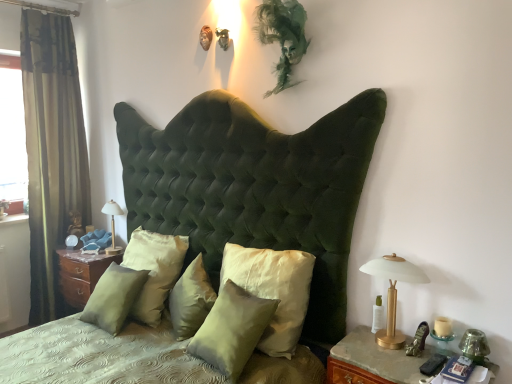
This screenshot has height=384, width=512. What do you see at coordinates (191, 299) in the screenshot? I see `satin green pillow at center, the 3th pillow positioned from the left` at bounding box center [191, 299].

What is the approximate width of matte white lampshade at center, the 1th bedside lamp from the back?

matte white lampshade at center, the 1th bedside lamp from the back, is 5.35 inches wide.

This screenshot has width=512, height=384. What do you see at coordinates (273, 290) in the screenshot?
I see `satin/velvet pillow at center, the 5th pillow in the left-to-right sequence` at bounding box center [273, 290].

How much space does gold metallic bedside lamp at right, which is counted as the second bedside lamp, starting from the left, occupy horizontally?

It is 5.69 inches.

Image resolution: width=512 pixels, height=384 pixels. I want to click on green velvet curtain at left, so click(52, 152).

Image resolution: width=512 pixels, height=384 pixels. Identify the location of satin green pillow at center, the 3th pillow positioned from the left. (191, 299).

From the image's perspective, which one is positioned lower, satin green pillow at center, the 5th pillow positioned from the right, or satin wood nightstand at lower left, marked as the second nightstand in a front-to-back arrangement?

From the image's view, satin wood nightstand at lower left, marked as the second nightstand in a front-to-back arrangement, is below.

In terms of width, does satin green pillow at center, the 5th pillow positioned from the right, look wider or thinner when compared to satin wood nightstand at lower left, placed as the first nightstand when sorted from left to right?

satin green pillow at center, the 5th pillow positioned from the right, is thinner than satin wood nightstand at lower left, placed as the first nightstand when sorted from left to right.

How many degrees apart are the facing directions of satin green pillow at center, the 1th pillow positioned from the left, and satin wood nightstand at lower left, placed as the first nightstand when sorted from left to right?

1.61 degrees.

Considering the positions of objects satin green pillow at center, the 5th pillow positioned from the right, and satin wood nightstand at lower left, marked as the first nightstand in a back-to-front arrangement, in the image provided, who is in front, satin green pillow at center, the 5th pillow positioned from the right, or satin wood nightstand at lower left, marked as the first nightstand in a back-to-front arrangement,?

Positioned in front is satin green pillow at center, the 5th pillow positioned from the right.

Between gold metallic bedside lamp at right, marked as the second bedside lamp in a back-to-front arrangement, and transparent glass window at left, which one appears on the left side from the viewer's perspective?

Positioned to the left is transparent glass window at left.

Is gold metallic bedside lamp at right, acting as the 1th bedside lamp starting from the front, taller than transparent glass window at left?

No.

Can transparent glass window at left be found inside gold metallic bedside lamp at right, which is counted as the second bedside lamp, starting from the left?

Definitely not — transparent glass window at left is not inside gold metallic bedside lamp at right, which is counted as the second bedside lamp, starting from the left.

Which bedside lamp is the 2nd one when counting from the front of the transparent glass window at left? Please provide its 2D coordinates.

[(393, 293)]

Is green velvet curtain at left turned away from velvet green headboard at center?

No, green velvet curtain at left's orientation is not away from velvet green headboard at center.

Is green velvet curtain at left to the left or to the right of velvet green headboard at center in the image?

From the image, it's evident that green velvet curtain at left is to the left of velvet green headboard at center.

In terms of width, does green velvet curtain at left look wider or thinner when compared to velvet green headboard at center?

Clearly, green velvet curtain at left has less width compared to velvet green headboard at center.

Is green velvet curtain at left touching velvet green headboard at center?

There is a gap between green velvet curtain at left and velvet green headboard at center.

From the image's perspective, which one is positioned higher, wooden nightstand at lower right, the 2th nightstand when ordered from back to front, or satin wood nightstand at lower left, marked as the second nightstand in a front-to-back arrangement?

satin wood nightstand at lower left, marked as the second nightstand in a front-to-back arrangement, from the image's perspective.

Consider the image. Between wooden nightstand at lower right, positioned as the first nightstand in front-to-back order, and satin wood nightstand at lower left, arranged as the 2th nightstand when viewed from the right, which one appears on the left side from the viewer's perspective?

Positioned to the left is satin wood nightstand at lower left, arranged as the 2th nightstand when viewed from the right.

Which object is thinner, wooden nightstand at lower right, positioned as the first nightstand in front-to-back order, or satin wood nightstand at lower left, placed as the first nightstand when sorted from left to right?

satin wood nightstand at lower left, placed as the first nightstand when sorted from left to right, is thinner.

From a real-world perspective, between wooden nightstand at lower right, positioned as the first nightstand in front-to-back order, and satin wood nightstand at lower left, placed as the first nightstand when sorted from left to right, who is vertically higher?

From a 3D spatial view, wooden nightstand at lower right, positioned as the first nightstand in front-to-back order, is above.

From the image's perspective, is matte white lampshade at center, marked as the 2th bedside lamp in a front-to-back arrangement, on satin/velvet pillow at center, the fourth pillow from the right?

Yes, from the image's perspective, matte white lampshade at center, marked as the 2th bedside lamp in a front-to-back arrangement, is on top of satin/velvet pillow at center, the fourth pillow from the right.

From a real-world perspective, which object rests below the other?

satin/velvet pillow at center, the fourth pillow from the right, from a real-world perspective.

Is matte white lampshade at center, the second bedside lamp in the right-to-left sequence, next to satin/velvet pillow at center, which ranks as the 2th pillow in left-to-right order?

No, matte white lampshade at center, the second bedside lamp in the right-to-left sequence, is not beside satin/velvet pillow at center, which ranks as the 2th pillow in left-to-right order.

Considering the points (144, 239) and (404, 355), which point is behind, point (144, 239) or point (404, 355)?

The point (144, 239) is more distant.

Is there a large distance between satin/velvet pillow at center, which ranks as the 2th pillow in left-to-right order, and wooden nightstand at lower right, the 2th nightstand when ordered from back to front?

Indeed, satin/velvet pillow at center, which ranks as the 2th pillow in left-to-right order, is not near wooden nightstand at lower right, the 2th nightstand when ordered from back to front.

Considering the relative sizes of satin/velvet pillow at center, which ranks as the 2th pillow in left-to-right order, and wooden nightstand at lower right, the 2th nightstand when ordered from back to front, in the image provided, is satin/velvet pillow at center, which ranks as the 2th pillow in left-to-right order, bigger than wooden nightstand at lower right, the 2th nightstand when ordered from back to front,?

No.

Who is shorter, satin/velvet pillow at center, which ranks as the 2th pillow in left-to-right order, or wooden nightstand at lower right, which is the 1th nightstand in right-to-left order?

Standing shorter between the two is wooden nightstand at lower right, which is the 1th nightstand in right-to-left order.

Is velvet green headboard at center taller or shorter than satin wood nightstand at lower left, marked as the second nightstand in a front-to-back arrangement?

Considering their sizes, velvet green headboard at center has more height than satin wood nightstand at lower left, marked as the second nightstand in a front-to-back arrangement.

This screenshot has width=512, height=384. I want to click on bed on the right of the satin wood nightstand at lower left, arranged as the 2th nightstand when viewed from the right, so pyautogui.click(x=255, y=186).

Between velvet green headboard at center and satin wood nightstand at lower left, marked as the first nightstand in a back-to-front arrangement, which one is positioned behind?

satin wood nightstand at lower left, marked as the first nightstand in a back-to-front arrangement, is behind.

Image resolution: width=512 pixels, height=384 pixels. There is a satin green pillow at center, the 5th pillow positioned from the right. Find the location of `the 1st nightstand below it (from the image's perspective)`. the 1st nightstand below it (from the image's perspective) is located at coordinates (81, 274).

Which bedside lamp is the 2nd one when counting from the right side of the transparent glass window at left? Please provide its 2D coordinates.

[(393, 293)]

Which object lies further to the anchor point gold metallic bedside lamp at right, which ranks as the 1th bedside lamp in right-to-left order, wooden nightstand at lower right, the 2th nightstand when ordered from back to front, or green velvet curtain at left?

green velvet curtain at left is further to gold metallic bedside lamp at right, which ranks as the 1th bedside lamp in right-to-left order.

Based on their spatial positions, is transparent glass window at left or gold metallic bedside lamp at right, which is counted as the second bedside lamp, starting from the left, closer to velvet green headboard at center?

Based on the image, gold metallic bedside lamp at right, which is counted as the second bedside lamp, starting from the left, appears to be nearer to velvet green headboard at center.

Based on the photo, from the image, which object appears to be nearer to wooden nightstand at lower right, positioned as the first nightstand in front-to-back order, satin/velvet pillow at center, which ranks as the 2th pillow in left-to-right order, or velvet green headboard at center?

velvet green headboard at center is closer to wooden nightstand at lower right, positioned as the first nightstand in front-to-back order.

Which object lies nearer to the anchor point satin green pillow at center, positioned as the 2th pillow in right-to-left order, velvet green headboard at center or satin green pillow at center, the 5th pillow positioned from the right?

velvet green headboard at center.

Estimate the real-world distances between objects in this image. Which object is closer to gold metallic bedside lamp at right, which is counted as the second bedside lamp, starting from the left, transparent glass window at left or matte white lampshade at center, the 1th bedside lamp from the back?

Among the two, matte white lampshade at center, the 1th bedside lamp from the back, is located nearer to gold metallic bedside lamp at right, which is counted as the second bedside lamp, starting from the left.

Considering their positions, is satin green pillow at center, the 3th pillow from the right, positioned further to green velvet curtain at left than velvet green headboard at center?

Among the two, satin green pillow at center, the 3th pillow from the right, is located further to green velvet curtain at left.

Looking at the image, which one is located further to satin wood nightstand at lower left, marked as the first nightstand in a back-to-front arrangement, satin/velvet pillow at center, the 5th pillow in the left-to-right sequence, or satin green pillow at center, the 1th pillow positioned from the left?

satin/velvet pillow at center, the 5th pillow in the left-to-right sequence.

Estimate the real-world distances between objects in this image. Which object is closer to wooden nightstand at lower right, the 2th nightstand when ordered from back to front, satin wood nightstand at lower left, marked as the second nightstand in a front-to-back arrangement, or satin/velvet pillow at center, the fourth pillow from the right?

satin/velvet pillow at center, the fourth pillow from the right, lies closer to wooden nightstand at lower right, the 2th nightstand when ordered from back to front, than the other object.

Where is `curtain between transparent glass window at left and satin green pillow at center, the 5th pillow positioned from the right`? curtain between transparent glass window at left and satin green pillow at center, the 5th pillow positioned from the right is located at coordinates (52, 152).

Where is `bedside lamp between satin/velvet pillow at center, acting as the 1th pillow starting from the right, and wooden nightstand at lower right, the 2th nightstand when ordered from back to front, in the horizontal direction`? bedside lamp between satin/velvet pillow at center, acting as the 1th pillow starting from the right, and wooden nightstand at lower right, the 2th nightstand when ordered from back to front, in the horizontal direction is located at coordinates (393, 293).

You are a GUI agent. You are given a task and a screenshot of the screen. Output one action in this format:
    pyautogui.click(x=<x>, y=<y>)
    Task: Click on the pillow between satin green pillow at center, the 1th pillow positioned from the left, and matte white lampshade at center, which ranks as the 1th bedside lamp in left-to-right order, in the front-back direction
    
    Given the screenshot: What is the action you would take?
    pyautogui.click(x=154, y=270)

You are a GUI agent. You are given a task and a screenshot of the screen. Output one action in this format:
    pyautogui.click(x=<x>, y=<y>)
    Task: Click on the bedside lamp between satin/velvet pillow at center, the fourth pillow from the right, and wooden nightstand at lower right, positioned as the first nightstand in front-to-back order, in the horizontal direction
    This screenshot has width=512, height=384.
    Given the screenshot: What is the action you would take?
    pyautogui.click(x=393, y=293)